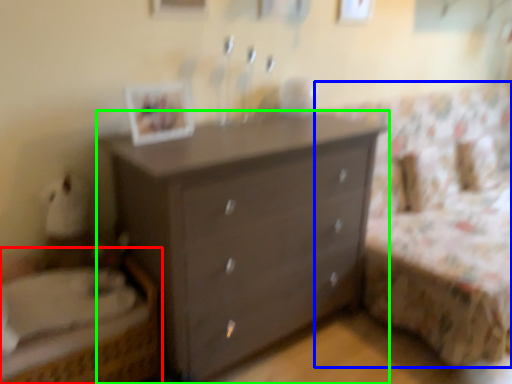
Question: Considering the real-world distances, which object is farthest from bed (highlighted by a red box)? bed frame (highlighted by a blue box) or chest of drawers (highlighted by a green box)?

Choices:
 (A) bed frame
 (B) chest of drawers

Answer: (A)